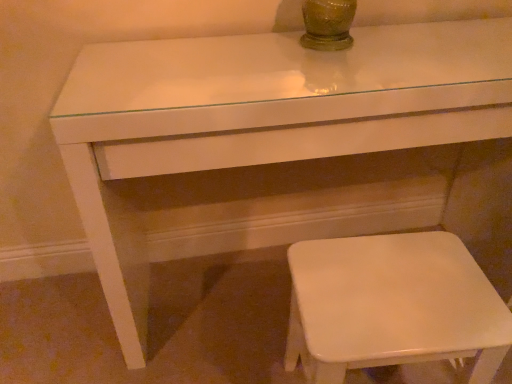
What do you see at coordinates (392, 306) in the screenshot? I see `white glossy stool at lower right` at bounding box center [392, 306].

This screenshot has height=384, width=512. In order to click on white glossy stool at lower right in this screenshot , I will do `click(392, 306)`.

Identify the location of white glossy stool at lower right. (392, 306).